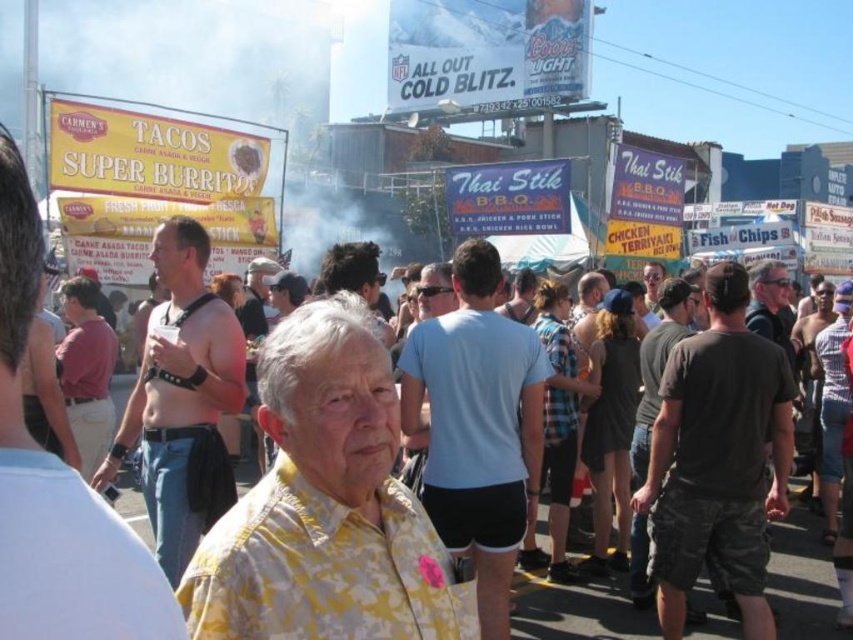
Does point (347, 342) lie behind point (163, 371)?

That is False.

Can you confirm if yellow printed shirt at center is positioned below shiny black tank top at center?

Yes.

Does point (405, 545) come behind point (198, 525)?

No, it is in front of (198, 525).

Where is `yellow printed shirt at center`? yellow printed shirt at center is located at coordinates (325, 506).

Is yellow printed shirt at center positioned behind matte black sunglasses at center?

No, yellow printed shirt at center is in front of matte black sunglasses at center.

Based on the photo, between yellow printed shirt at center and matte black sunglasses at center, which one appears on the left side from the viewer's perspective?

From the viewer's perspective, yellow printed shirt at center appears more on the left side.

Which is in front, point (297, 486) or point (651, 305)?

Point (297, 486) is more forward.

The height and width of the screenshot is (640, 853). In order to click on yellow printed shirt at center in this screenshot , I will do `click(325, 506)`.

Is point (22, 536) positioned behind point (647, 276)?

No.

Where is `light brown leather belt at left`? The image size is (853, 640). light brown leather belt at left is located at coordinates (57, 484).